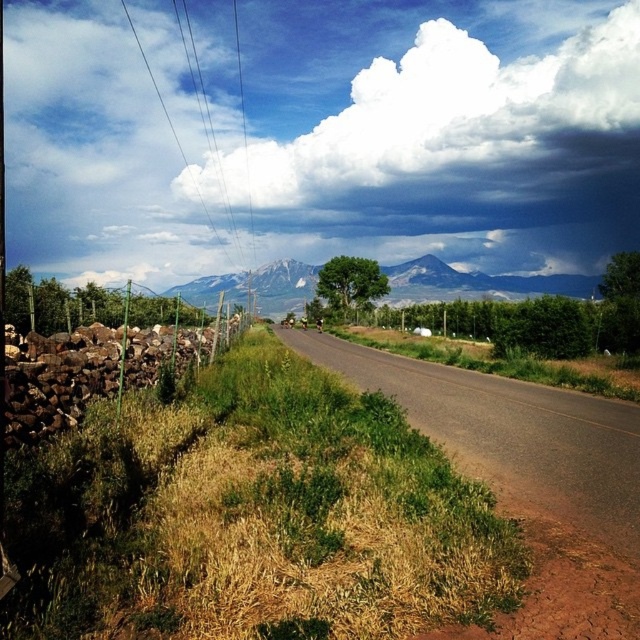
You are a hiker standing at the edge of the road looking towards the gray rocky mountain at center. Can you see the white fluffy cloud at upper center above the mountain?

Yes, the white fluffy cloud at upper center is located above the gray rocky mountain at center, so you can see it above the mountain.